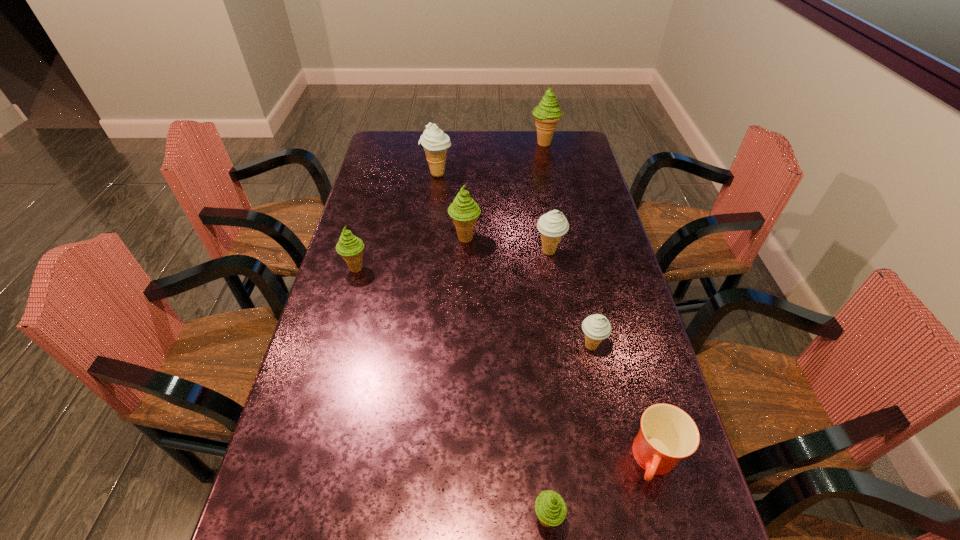
The image size is (960, 540). I want to click on the tallest icecream, so click(x=547, y=114).

Image resolution: width=960 pixels, height=540 pixels. Find the location of `the rightmost green icecream`. the rightmost green icecream is located at coordinates point(547,114).

This screenshot has height=540, width=960. Find the location of `the sixth nearest icecream`. the sixth nearest icecream is located at coordinates (435, 142).

Image resolution: width=960 pixels, height=540 pixels. What are the coordinates of `the leftmost beige icecream` in the screenshot? It's located at (435, 142).

At what (x,y) coordinates should I click in order to perform the action: click on the third nearest green icecream. Please return your answer as a coordinate pair (x, y). Looking at the image, I should click on (464, 211).

Where is `the third green icecream from right to left`? Image resolution: width=960 pixels, height=540 pixels. the third green icecream from right to left is located at coordinates (464, 211).

Image resolution: width=960 pixels, height=540 pixels. What are the coordinates of `the second smallest green icecream` in the screenshot? It's located at (350, 247).

The height and width of the screenshot is (540, 960). I want to click on the leftmost icecream, so click(350, 247).

Where is `the second farthest beige icecream`? the second farthest beige icecream is located at coordinates (552, 225).

Where is `the smallest beige icecream`? This screenshot has width=960, height=540. the smallest beige icecream is located at coordinates (596, 328).